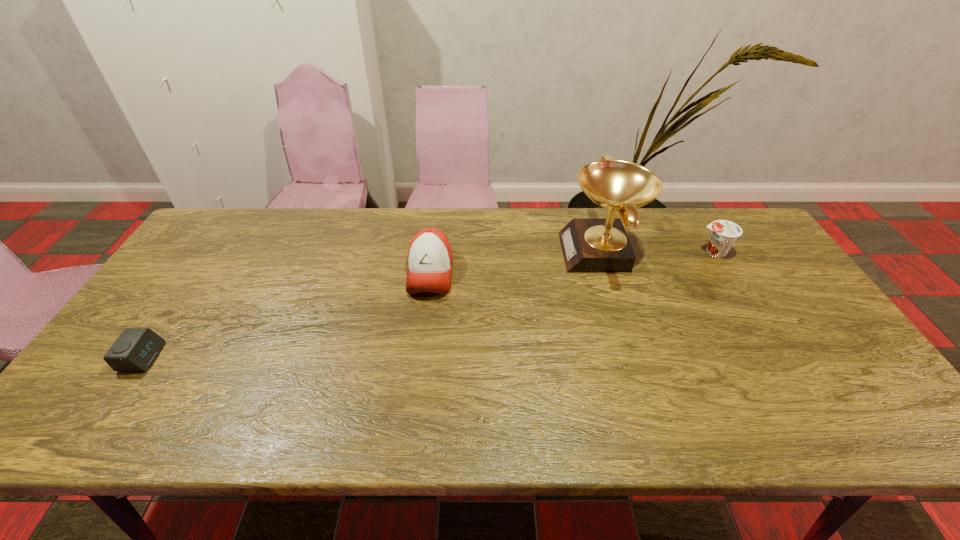
Image resolution: width=960 pixels, height=540 pixels. I want to click on free space at the far edge of the desktop, so click(300, 228).

This screenshot has width=960, height=540. In the image, there is a desktop. Find the location of `vacant space at the near edge`. vacant space at the near edge is located at coordinates (652, 433).

Image resolution: width=960 pixels, height=540 pixels. In the image, there is a desktop. Identify the location of vacant space at the left edge. (198, 306).

This screenshot has width=960, height=540. Identify the location of vacant position at the right edge of the desktop. (770, 281).

The width and height of the screenshot is (960, 540). Find the location of `empty space between the leftmost object and the baseball cap`. empty space between the leftmost object and the baseball cap is located at coordinates (286, 315).

This screenshot has width=960, height=540. Identify the location of vacant region between the alarm clock and the second tallest object. point(286,315).

At what (x,y) coordinates should I click in order to perform the action: click on vacant area between the baseball cap and the alarm clock. Please return your answer as a coordinate pair (x, y). The image size is (960, 540). Looking at the image, I should click on (286, 315).

Identify the location of vacant area that lies between the rightmost object and the award. (658, 252).

The image size is (960, 540). What are the coordinates of `vacant area that lies between the third shortest object and the award` in the screenshot? It's located at (516, 262).

The image size is (960, 540). In order to click on empty space that is in between the third shortest object and the nearest object in this screenshot , I will do `click(286, 315)`.